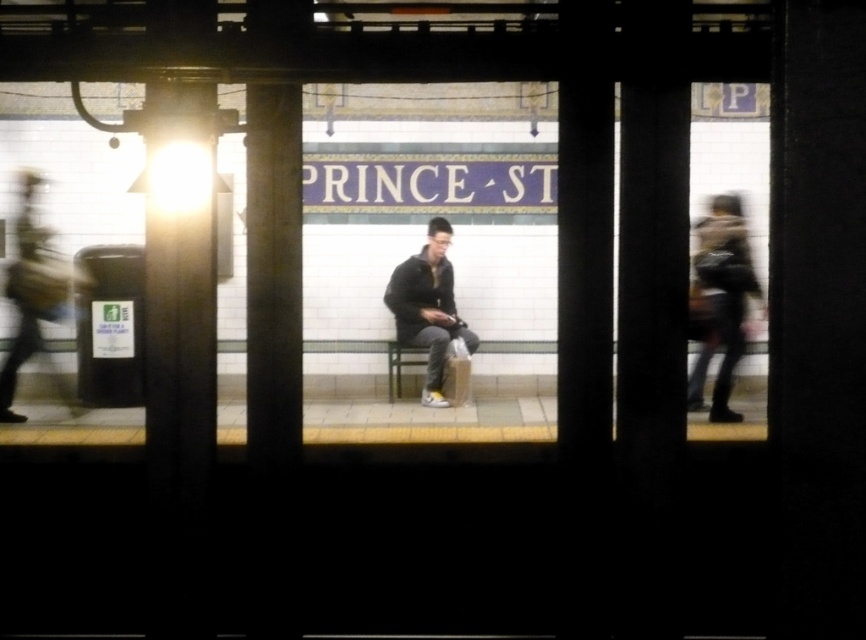
Question: Which object is the farthest from the metallic column at left?

Choices:
 (A) camouflage-patterned jacket at right
 (B) dark gray jacket at center
 (C) smooth concrete pillar at center

Answer: (A)

Question: Considering the relative positions of metallic column at left and dark gray jacket at center in the image provided, where is metallic column at left located with respect to dark gray jacket at center?

Choices:
 (A) left
 (B) right

Answer: (A)

Question: Observing the image, what is the correct spatial positioning of smooth concrete pillar at center in reference to camouflage-patterned jacket at right?

Choices:
 (A) above
 (B) below

Answer: (A)

Question: Is metallic column at left bigger than smooth concrete pillar at center?

Choices:
 (A) yes
 (B) no

Answer: (A)

Question: Which point is farther from the camera taking this photo?

Choices:
 (A) (160, 227)
 (B) (754, 275)
 (C) (262, 132)
 (D) (412, 262)

Answer: (D)

Question: Which point is closer to the camera taking this photo?

Choices:
 (A) (424, 250)
 (B) (734, 196)
 (C) (170, 376)
 (D) (249, 195)

Answer: (C)